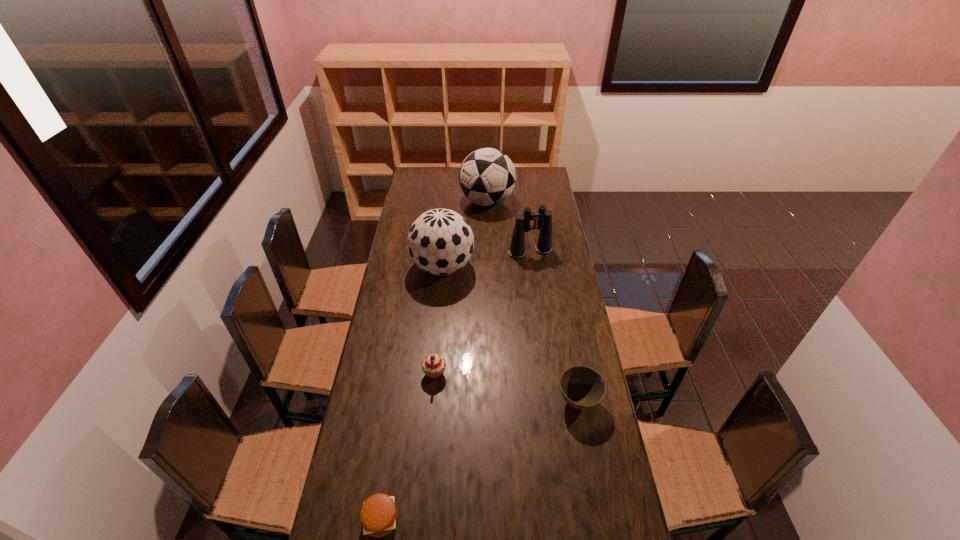
The image size is (960, 540). I want to click on empty space between the shortest object and the bowl, so click(480, 460).

Select which object appears as the fourth closest to the fifth tallest object. Please provide its 2D coordinates. Your answer should be formatted as a tuple, i.e. [(x, y)], where the tuple contains the x and y coordinates of a point satisfying the conditions above.

[(544, 217)]

Identify the location of object that ranks as the fourth closest to the cupcake. The height and width of the screenshot is (540, 960). (544, 217).

At what (x,y) coordinates should I click in order to perform the action: click on free space that satisfies the following two spatial constraints: 1. on the back side of the hamburger; 2. on the right side of the cupcake. Please return your answer as a coordinate pair (x, y). Looking at the image, I should click on (403, 374).

At what (x,y) coordinates should I click in order to perform the action: click on vacant space that satisfies the following two spatial constraints: 1. on the surface of the farther soccer ball where the brand logo is visible; 2. on the front side of the cupcake. Please return your answer as a coordinate pair (x, y). This screenshot has height=540, width=960. Looking at the image, I should click on (491, 374).

Where is `free space that satisfies the following two spatial constraints: 1. on the front side of the nearer soccer ball; 2. on the left side of the cupcake`? This screenshot has height=540, width=960. free space that satisfies the following two spatial constraints: 1. on the front side of the nearer soccer ball; 2. on the left side of the cupcake is located at coordinates pyautogui.click(x=433, y=374).

Locate an element on the screen. Image resolution: width=960 pixels, height=540 pixels. free space that satisfies the following two spatial constraints: 1. on the back side of the hamburger; 2. on the right side of the bowl is located at coordinates (399, 401).

In order to click on free space that satisfies the following two spatial constraints: 1. on the back side of the bowl; 2. on the left side of the hamburger in this screenshot , I will do `click(399, 401)`.

Find the location of a particular element. vacant space that satisfies the following two spatial constraints: 1. on the surface of the second shortest object where the brand logo is visible; 2. on the left side of the farther soccer ball is located at coordinates (492, 401).